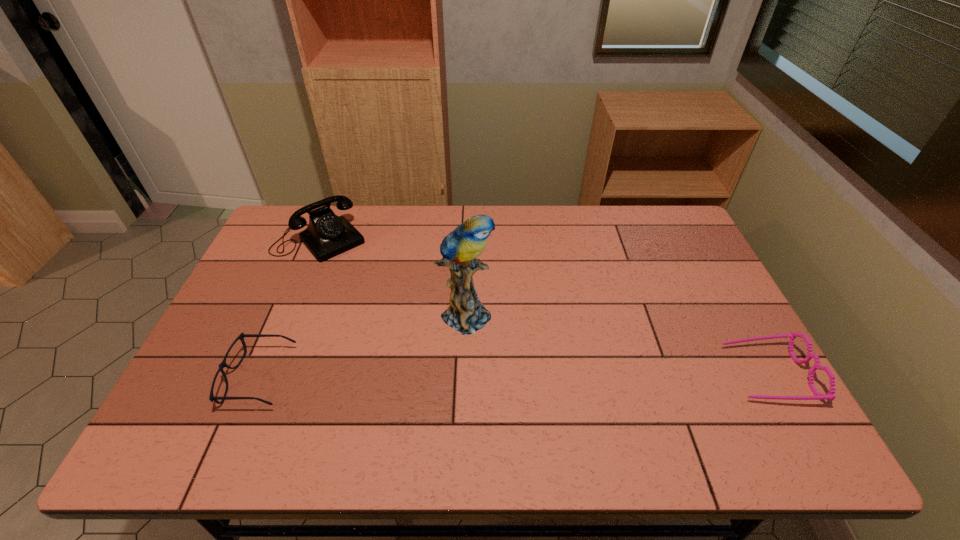
This screenshot has width=960, height=540. In order to click on telephone that is positioned at the left edge in this screenshot , I will do `click(327, 235)`.

The width and height of the screenshot is (960, 540). Identify the location of object located in the right edge section of the desktop. coord(830,395).

Locate an element on the screen. object that is at the far left corner is located at coordinates (327, 235).

Image resolution: width=960 pixels, height=540 pixels. Identify the location of object situated at the near left corner. (223, 364).

Locate an element on the screen. The height and width of the screenshot is (540, 960). object located at the near right corner is located at coordinates (830, 395).

Locate an element on the screen. free spot at the far edge of the desktop is located at coordinates (624, 248).

The width and height of the screenshot is (960, 540). Find the location of `free space at the near edge of the desktop`. free space at the near edge of the desktop is located at coordinates (494, 391).

Where is `free space at the left edge`? Image resolution: width=960 pixels, height=540 pixels. free space at the left edge is located at coordinates (226, 342).

Image resolution: width=960 pixels, height=540 pixels. I want to click on vacant region at the right edge, so click(705, 346).

This screenshot has height=540, width=960. I want to click on vacant space at the far right corner of the desktop, so click(x=642, y=207).